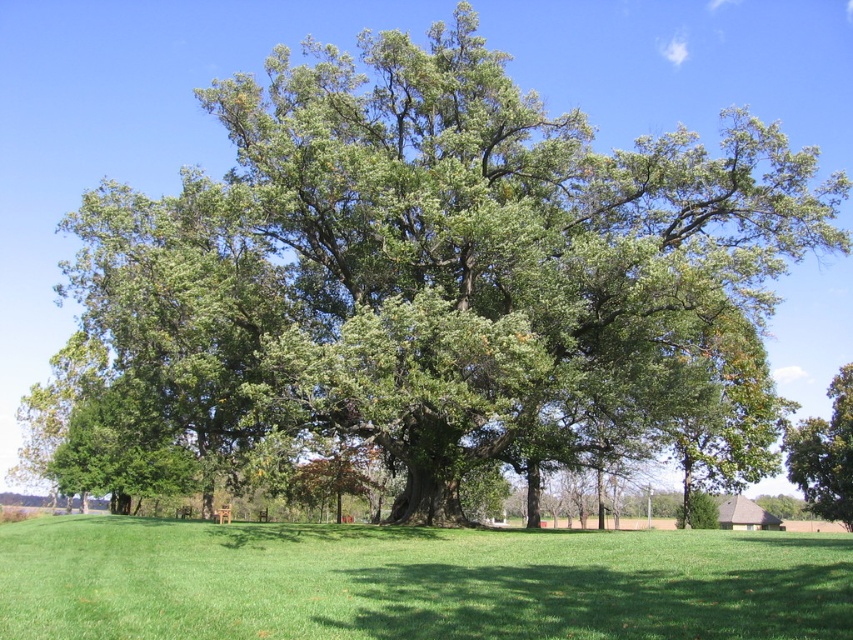
You are standing at the origin point in the image. Which direction should you walk to reach the green grass at center?

The green grass at center is located at coordinates point (415,580), so you should walk towards the right and slightly downward direction from your current position at the origin to reach it.

You are standing at the point marked by point (x=415, y=580). What is the color of the ground beneath you?

The point (x=415, y=580) corresponds to the green grass at center, so the ground beneath you is green.